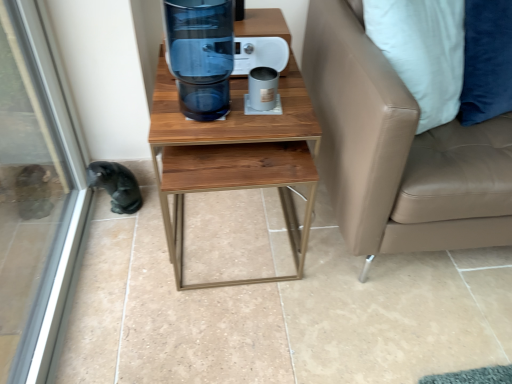
Locate an element on the screen. The height and width of the screenshot is (384, 512). vacant space behind transparent glass water cooler at center is located at coordinates (211, 86).